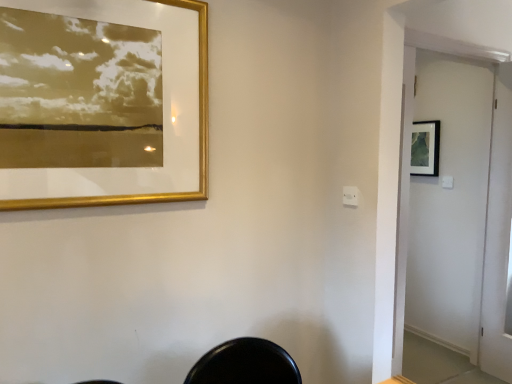
Question: Is gold metallic picture frame at upper left, the second picture frame viewed from the back, facing towards white glossy screen door at right?

Choices:
 (A) yes
 (B) no

Answer: (B)

Question: Can you confirm if gold metallic picture frame at upper left, acting as the second picture frame starting from the right, is positioned to the right of white glossy screen door at right?

Choices:
 (A) yes
 (B) no

Answer: (B)

Question: Is gold metallic picture frame at upper left, which appears as the first picture frame when viewed from the left, shorter than white glossy screen door at right?

Choices:
 (A) no
 (B) yes

Answer: (B)

Question: Is gold metallic picture frame at upper left, acting as the second picture frame starting from the right, looking in the opposite direction of white glossy screen door at right?

Choices:
 (A) yes
 (B) no

Answer: (B)

Question: From the image's perspective, is gold metallic picture frame at upper left, the second picture frame viewed from the back, on top of white glossy screen door at right?

Choices:
 (A) yes
 (B) no

Answer: (A)

Question: Is the position of gold metallic picture frame at upper left, placed as the first picture frame when sorted from front to back, less distant than that of white glossy screen door at right?

Choices:
 (A) no
 (B) yes

Answer: (B)

Question: Are white glossy screen door at right and matte black picture frame at upper right, the 2th picture frame when ordered from front to back, making contact?

Choices:
 (A) no
 (B) yes

Answer: (A)

Question: Is white glossy screen door at right positioned in front of matte black picture frame at upper right, which is the second picture frame in left-to-right order?

Choices:
 (A) yes
 (B) no

Answer: (A)

Question: Would you say white glossy screen door at right contains matte black picture frame at upper right, the 2th picture frame when ordered from front to back?

Choices:
 (A) no
 (B) yes

Answer: (A)

Question: Does white glossy screen door at right have a greater width compared to matte black picture frame at upper right, the 2th picture frame when ordered from front to back?

Choices:
 (A) no
 (B) yes

Answer: (B)

Question: Are white glossy screen door at right and matte black picture frame at upper right, which is the second picture frame in left-to-right order, far apart?

Choices:
 (A) no
 (B) yes

Answer: (A)

Question: Can you confirm if white glossy screen door at right is thinner than matte black picture frame at upper right, which is counted as the 1th picture frame, starting from the right?

Choices:
 (A) no
 (B) yes

Answer: (A)

Question: Is white glossy screen door at right further to the viewer compared to gold metallic picture frame at upper left, the second picture frame viewed from the back?

Choices:
 (A) no
 (B) yes

Answer: (B)